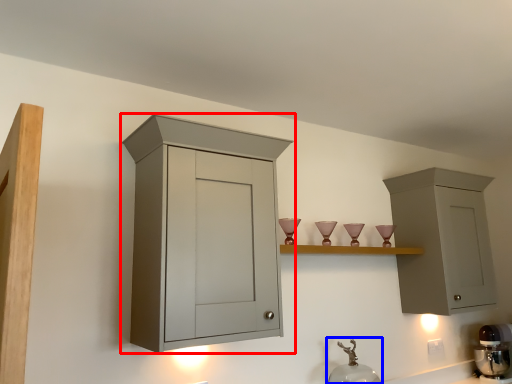
Question: Which of the following is the closest to the observer, cabinetry (highlighted by a red box) or faucet (highlighted by a blue box)?

Choices:
 (A) cabinetry
 (B) faucet

Answer: (A)